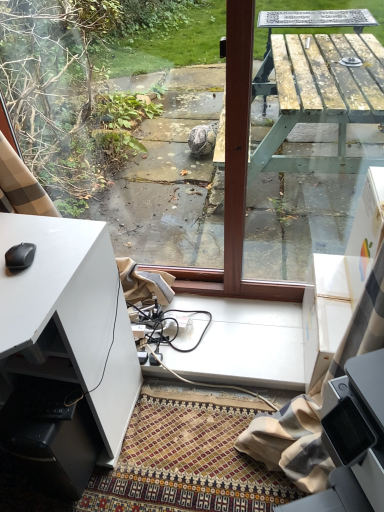
Locate an element on the screen. Image resolution: width=384 pixels, height=512 pixels. black matte mouse at lower left is located at coordinates (20, 257).

Consider the image. Which of these two, black matte mouse at lower left or white matte desk at lower left, is wider?

Wider between the two is white matte desk at lower left.

From their relative heights in the image, would you say black matte mouse at lower left is taller or shorter than white matte desk at lower left?

Clearly, black matte mouse at lower left is shorter compared to white matte desk at lower left.

Measure the distance between black matte mouse at lower left and white matte desk at lower left.

27.35 centimeters.

Considering the sizes of objects black matte mouse at lower left and white matte desk at lower left in the image provided, who is bigger, black matte mouse at lower left or white matte desk at lower left?

white matte desk at lower left is bigger.

Consider the image. Can you see wooden picnic table at center touching black matte mouse at lower left?

They are not placed beside each other.

From the picture: Who is more distant, wooden picnic table at center or black matte mouse at lower left?

black matte mouse at lower left is further from the camera.

Does point (291, 45) come in front of point (20, 268)?

That is False.

In the scene shown: Is wooden picnic table at center taller than black matte mouse at lower left?

Yes.

In the scene shown: Which object is more forward, wooden picnic table at center or white matte desk at lower left?

white matte desk at lower left is more forward.

How many degrees apart are the facing directions of wooden picnic table at center and white matte desk at lower left?

They differ by 2.37 degrees in their facing directions.

From the image's perspective, which one is positioned higher, wooden picnic table at center or white matte desk at lower left?

From the image's view, wooden picnic table at center is above.

Is white matte desk at lower left to the right of wooden picnic table at center from the viewer's perspective?

No.

Which of these two, white matte desk at lower left or wooden picnic table at center, is thinner?

wooden picnic table at center is thinner.

Choose the correct answer: Is white matte desk at lower left inside wooden picnic table at center or outside it?

white matte desk at lower left is not enclosed by wooden picnic table at center.

Is white matte desk at lower left looking in the opposite direction of wooden picnic table at center?

No, white matte desk at lower left is not facing the opposite direction of wooden picnic table at center.

Is black matte mouse at lower left beside wooden picnic table at center?

No, black matte mouse at lower left is not in contact with wooden picnic table at center.

This screenshot has height=512, width=384. What are the coordinates of `mouse behind the wooden picnic table at center` in the screenshot? It's located at (20, 257).

From the picture: Is wooden picnic table at center located within black matte mouse at lower left?

That's incorrect, wooden picnic table at center is not inside black matte mouse at lower left.

Does black matte mouse at lower left have a smaller size compared to wooden picnic table at center?

Correct, black matte mouse at lower left occupies less space than wooden picnic table at center.

In the scene shown: From the image's perspective, is white matte desk at lower left over black matte mouse at lower left?

No.

Which point is more distant from viewer, (30, 318) or (30, 252)?

The point (30, 252) is farther from the camera.

Is white matte desk at lower left inside or outside of black matte mouse at lower left?

white matte desk at lower left is not inside black matte mouse at lower left, it's outside.

In terms of width, does white matte desk at lower left look wider or thinner when compared to black matte mouse at lower left?

Clearly, white matte desk at lower left has more width compared to black matte mouse at lower left.

The image size is (384, 512). I want to click on desk below the black matte mouse at lower left (from the image's perspective), so click(x=60, y=289).

Find the location of a particular element. This screenshot has width=384, height=512. table in front of the black matte mouse at lower left is located at coordinates (318, 95).

Estimate the real-world distances between objects in this image. Which object is further from black matte mouse at lower left, white matte desk at lower left or wooden picnic table at center?

wooden picnic table at center is positioned further to the anchor black matte mouse at lower left.

Based on their spatial positions, is white matte desk at lower left or black matte mouse at lower left further from wooden picnic table at center?

black matte mouse at lower left is further to wooden picnic table at center.

Which object lies further to the anchor point white matte desk at lower left, black matte mouse at lower left or wooden picnic table at center?

The object further to white matte desk at lower left is wooden picnic table at center.

Looking at the image, which one is located closer to white matte desk at lower left, wooden picnic table at center or black matte mouse at lower left?

Based on the image, black matte mouse at lower left appears to be nearer to white matte desk at lower left.

Estimate the real-world distances between objects in this image. Which object is further from black matte mouse at lower left, wooden picnic table at center or white matte desk at lower left?

Among the two, wooden picnic table at center is located further to black matte mouse at lower left.

From the image, which object appears to be nearer to wooden picnic table at center, black matte mouse at lower left or white matte desk at lower left?

white matte desk at lower left lies closer to wooden picnic table at center than the other object.

You are a GUI agent. You are given a task and a screenshot of the screen. Output one action in this format:
    pyautogui.click(x=<x>, y=<y>)
    Task: Click on the mouse situated between white matte desk at lower left and wooden picnic table at center from left to right
    
    Given the screenshot: What is the action you would take?
    pyautogui.click(x=20, y=257)